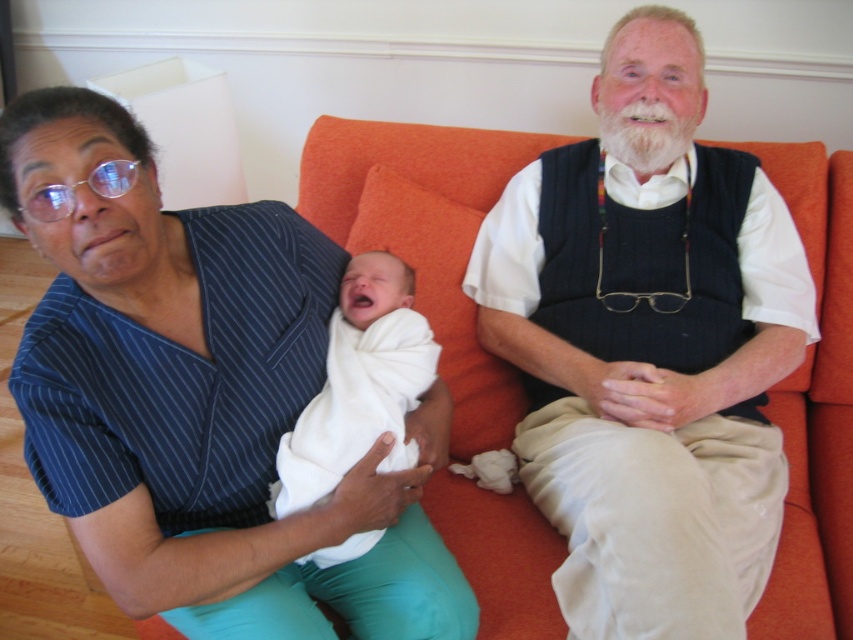
Question: Can you confirm if blue striped shirt at upper left is positioned below white knit vest at center?

Choices:
 (A) yes
 (B) no

Answer: (A)

Question: Which point is farther from the camera taking this photo?

Choices:
 (A) (560, 435)
 (B) (280, 419)
 (C) (412, 356)

Answer: (A)

Question: Is blue striped shirt at upper left above white knit vest at center?

Choices:
 (A) yes
 (B) no

Answer: (B)

Question: Can you confirm if blue striped shirt at upper left is smaller than white knit vest at center?

Choices:
 (A) no
 (B) yes

Answer: (B)

Question: Estimate the real-world distances between objects in this image. Which object is closer to the white soft swaddle at center?

Choices:
 (A) white knit vest at center
 (B) blue striped shirt at upper left

Answer: (B)

Question: Estimate the real-world distances between objects in this image. Which object is farther from the blue striped shirt at upper left?

Choices:
 (A) white knit vest at center
 (B) white soft swaddle at center

Answer: (A)